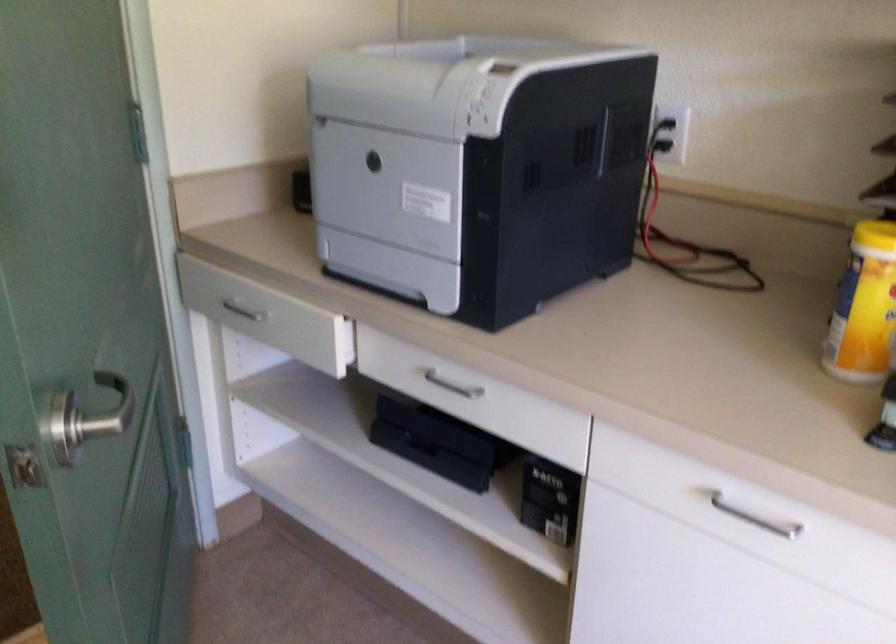
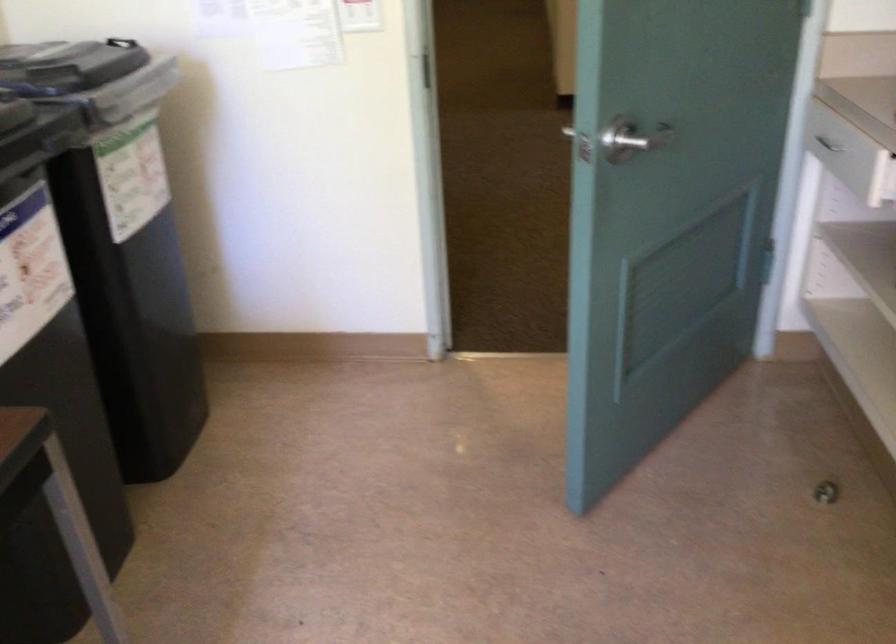
Question: The images are taken continuously from a first-person perspective. In which direction is your viewpoint rotating?

Choices:
 (A) Left
 (B) Right
 (C) Up
 (D) Down

Answer: (A)